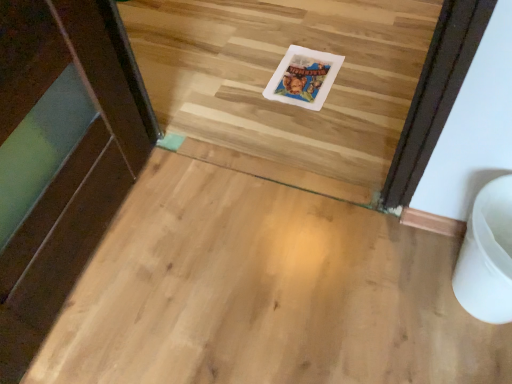
Image resolution: width=512 pixels, height=384 pixels. Identify the location of white plastic toilet bowl at lower right. (487, 255).

Describe the element at coordinates (487, 255) in the screenshot. This screenshot has height=384, width=512. I see `white plastic toilet bowl at lower right` at that location.

This screenshot has height=384, width=512. What do you see at coordinates (303, 77) in the screenshot? I see `white plastic postcard at center` at bounding box center [303, 77].

This screenshot has height=384, width=512. Find the location of `white plastic postcard at center`. white plastic postcard at center is located at coordinates (303, 77).

Where is `white plastic toilet bowl at lower right`? The width and height of the screenshot is (512, 384). white plastic toilet bowl at lower right is located at coordinates (487, 255).

Does white plastic toilet bowl at lower right appear on the right side of white plastic postcard at center?

Indeed, white plastic toilet bowl at lower right is positioned on the right side of white plastic postcard at center.

Is white plastic toilet bowl at lower right closer to the viewer compared to white plastic postcard at center?

Yes, it is.

Which is nearer, (507, 274) or (302, 74)?

The point (507, 274) is in front.

From the image's perspective, does white plastic toilet bowl at lower right appear higher than white plastic postcard at center?

Actually, white plastic toilet bowl at lower right appears below white plastic postcard at center in the image.

Based on the photo, from a real-world perspective, between white plastic toilet bowl at lower right and white plastic postcard at center, who is vertically higher?

white plastic toilet bowl at lower right is physically above.

Looking at this image, considering the relative sizes of white plastic toilet bowl at lower right and white plastic postcard at center in the image provided, is white plastic toilet bowl at lower right wider than white plastic postcard at center?

No, white plastic toilet bowl at lower right is not wider than white plastic postcard at center.

Is white plastic toilet bowl at lower right taller than white plastic postcard at center?

Indeed, white plastic toilet bowl at lower right has a greater height compared to white plastic postcard at center.

Considering the sizes of objects white plastic toilet bowl at lower right and white plastic postcard at center in the image provided, who is bigger, white plastic toilet bowl at lower right or white plastic postcard at center?

With larger size is white plastic toilet bowl at lower right.

Which is correct: white plastic toilet bowl at lower right is inside white plastic postcard at center, or outside of it?

The correct answer is: outside.

Is white plastic toilet bowl at lower right next to white plastic postcard at center and touching it?

No, white plastic toilet bowl at lower right is not touching white plastic postcard at center.

Could you tell me if white plastic toilet bowl at lower right is facing white plastic postcard at center?

No, white plastic toilet bowl at lower right is not aimed at white plastic postcard at center.

How many degrees apart are the facing directions of white plastic toilet bowl at lower right and white plastic postcard at center?

0.891 degrees.

How far apart are white plastic toilet bowl at lower right and white plastic postcard at center?

The distance of white plastic toilet bowl at lower right from white plastic postcard at center is 29.60 inches.

At what (x,y) coordinates should I click in order to perform the action: click on toilet bowl above the white plastic postcard at center (from a real-world perspective). Please return your answer as a coordinate pair (x, y). The image size is (512, 384). Looking at the image, I should click on (487, 255).

Can you confirm if white plastic postcard at center is positioned to the right of white plastic toilet bowl at lower right?

No.

In the scene shown: Which is behind, white plastic postcard at center or white plastic toilet bowl at lower right?

white plastic postcard at center is further from the camera.

Is point (320, 65) more distant than point (457, 276)?

Yes, it is behind point (457, 276).

From the picture: From the image's perspective, which one is positioned higher, white plastic postcard at center or white plastic toilet bowl at lower right?

white plastic postcard at center appears higher in the image.

From a real-world perspective, is white plastic postcard at center positioned over white plastic toilet bowl at lower right based on gravity?

No, from a real-world perspective, white plastic postcard at center is not on top of white plastic toilet bowl at lower right.

Looking at their sizes, would you say white plastic postcard at center is wider or thinner than white plastic toilet bowl at lower right?

Considering their sizes, white plastic postcard at center looks broader than white plastic toilet bowl at lower right.

Is white plastic postcard at center shorter than white plastic toilet bowl at lower right?

Indeed, white plastic postcard at center has a lesser height compared to white plastic toilet bowl at lower right.

Between white plastic postcard at center and white plastic toilet bowl at lower right, which one has smaller size?

Smaller between the two is white plastic postcard at center.

Is white plastic postcard at center inside the boundaries of white plastic toilet bowl at lower right, or outside?

white plastic postcard at center lies outside white plastic toilet bowl at lower right.

Is white plastic postcard at center not near white plastic toilet bowl at lower right?

Actually, white plastic postcard at center and white plastic toilet bowl at lower right are a little close together.

Could you tell me if white plastic postcard at center is turned towards white plastic toilet bowl at lower right?

No, white plastic postcard at center is not facing towards white plastic toilet bowl at lower right.

What's the angular difference between white plastic postcard at center and white plastic toilet bowl at lower right's facing directions?

The angle between the facing direction of white plastic postcard at center and the facing direction of white plastic toilet bowl at lower right is 0.891 degrees.

At what (x,y) coordinates should I click in order to perform the action: click on postcard located on the left of white plastic toilet bowl at lower right. Please return your answer as a coordinate pair (x, y). Looking at the image, I should click on pyautogui.click(x=303, y=77).

In the image, there is a white plastic toilet bowl at lower right. Where is `postcard below it (from a real-world perspective)`? This screenshot has width=512, height=384. postcard below it (from a real-world perspective) is located at coordinates (303, 77).

In order to click on toilet bowl on the right of white plastic postcard at center in this screenshot , I will do `click(487, 255)`.